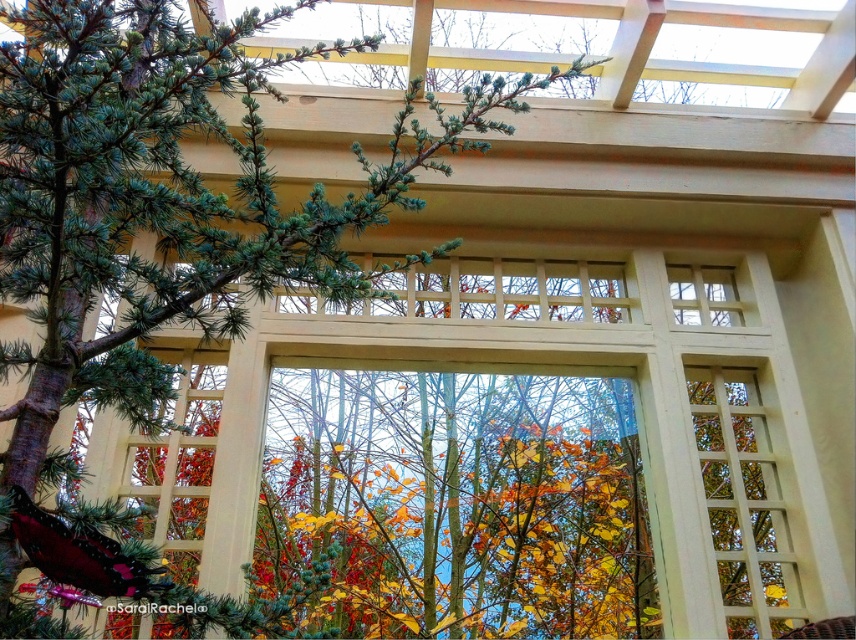
Question: Among these points, which one is farthest from the camera?

Choices:
 (A) (13, 410)
 (B) (542, 403)

Answer: (B)

Question: Is white lattice window at center above green needle-like at left?

Choices:
 (A) yes
 (B) no

Answer: (B)

Question: Observing the image, what is the correct spatial positioning of white lattice window at center in reference to green needle-like at left?

Choices:
 (A) left
 (B) right

Answer: (B)

Question: From the image, what is the correct spatial relationship of white lattice window at center in relation to green needle-like at left?

Choices:
 (A) below
 (B) above

Answer: (A)

Question: Which point is farther from the camera taking this photo?

Choices:
 (A) (122, 589)
 (B) (797, 563)

Answer: (B)